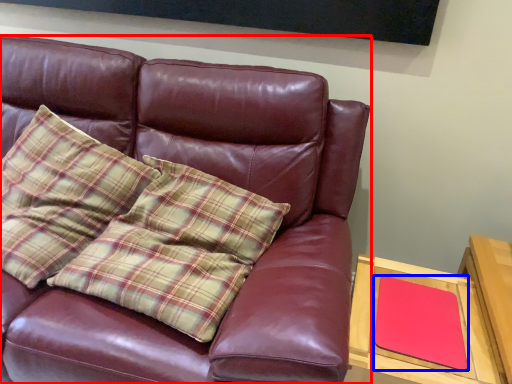
Question: Which point is further to the camera, studio couch (highlighted by a red box) or pad (highlighted by a blue box)?

Choices:
 (A) studio couch
 (B) pad

Answer: (B)